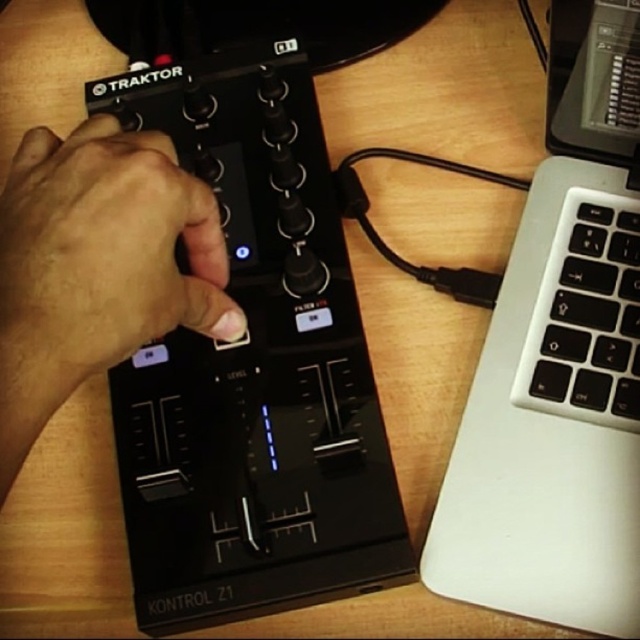
Question: Can you confirm if black matte hand at center is wider than white plastic keyboard at right?

Choices:
 (A) no
 (B) yes

Answer: (B)

Question: Estimate the real-world distances between objects in this image. Which object is closer to the white plastic keyboard at right?

Choices:
 (A) silver/black plastic laptop at right
 (B) black matte hand at center

Answer: (A)

Question: Is black matte hand at center above white plastic keyboard at right?

Choices:
 (A) yes
 (B) no

Answer: (A)

Question: Which of the following is the farthest from the observer?

Choices:
 (A) black matte hand at center
 (B) white plastic keyboard at right
 (C) silver/black plastic laptop at right

Answer: (B)

Question: Which object appears farthest from the camera in this image?

Choices:
 (A) white plastic keyboard at right
 (B) black matte hand at center

Answer: (A)

Question: Where is silver/black plastic laptop at right located in relation to black matte hand at center in the image?

Choices:
 (A) below
 (B) above

Answer: (A)